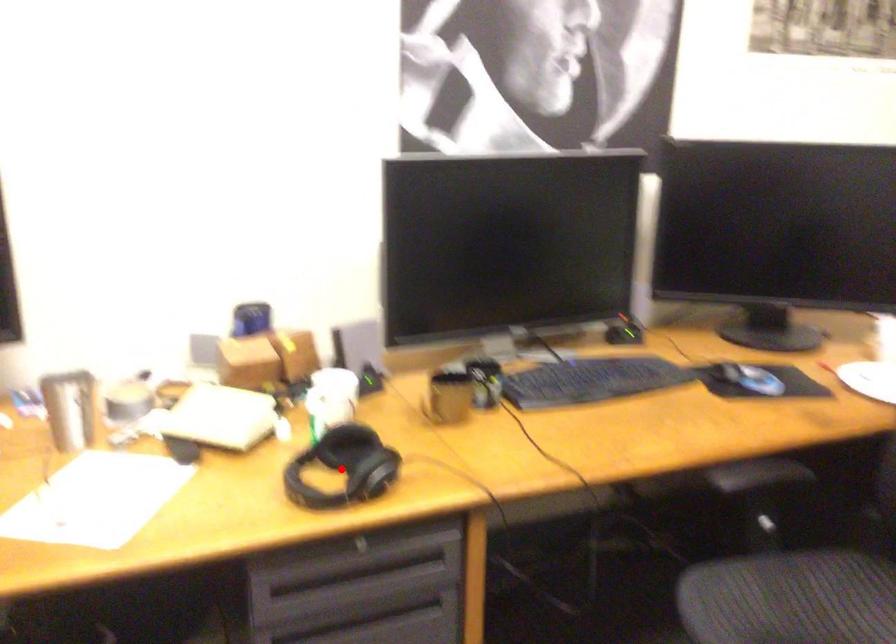
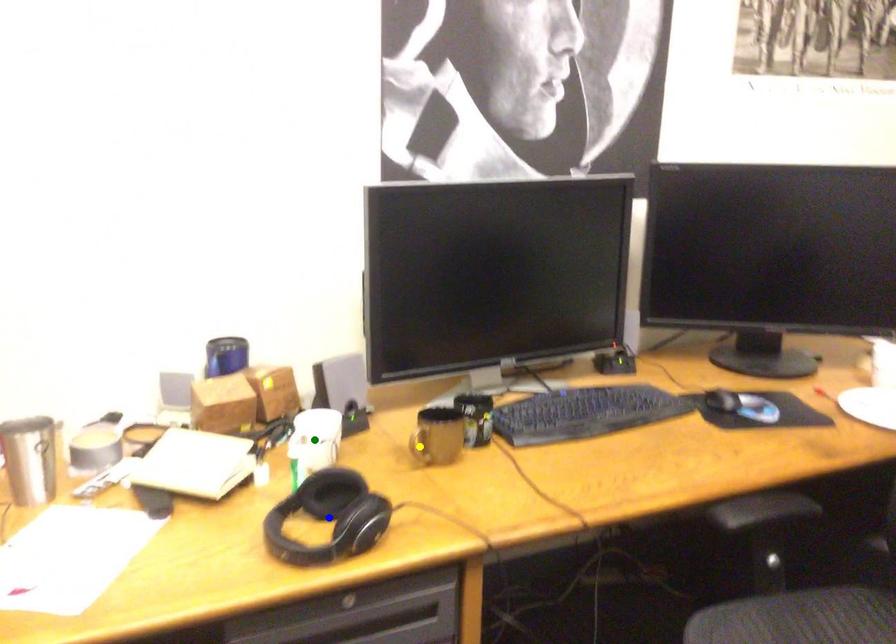
Question: I am providing you with two images of the same scene from different viewpoints. A red point is marked on the first image. You are given multiple points on the second image. Which mark in image 2 goes with the point in image 1?

Choices:
 (A) green point
 (B) yellow point
 (C) blue point

Answer: (C)